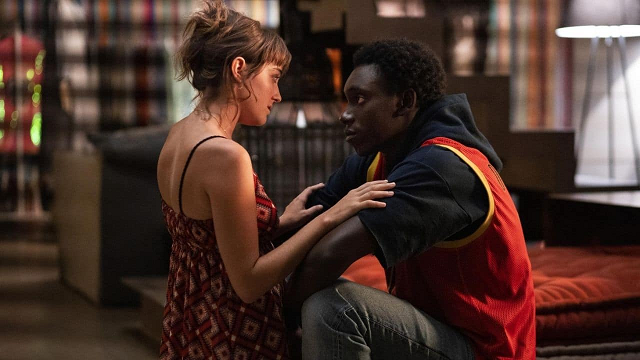
This screenshot has height=360, width=640. Find the location of `couch`. couch is located at coordinates (112, 195).